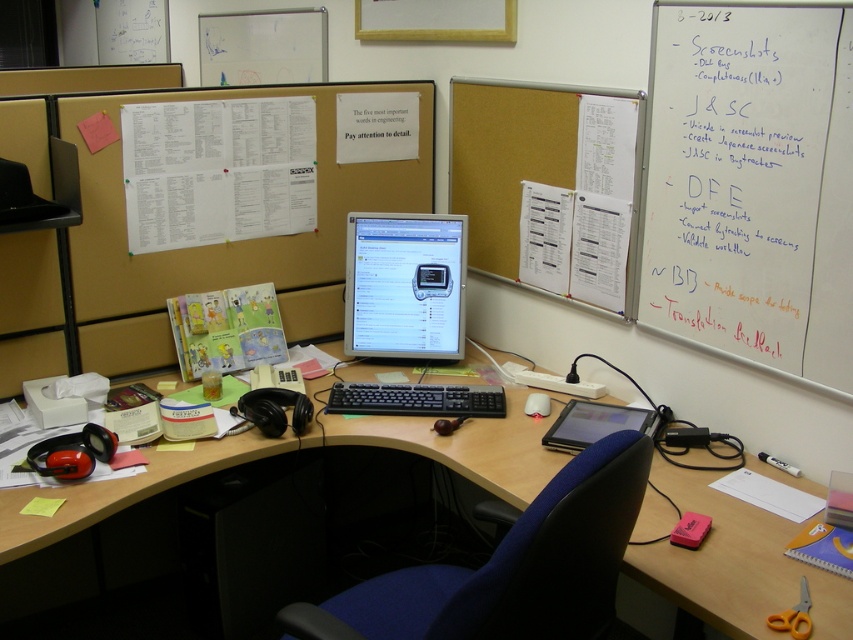
Looking at the desk in the scene, which monitor is positioned to the left between the matte black monitor at center and the matte plastic monitor at center?

The matte black monitor at center is positioned to the left of the matte plastic monitor at center.

You are a person who needs to sit down at the desk. The blue fabric swivel chair at center and the black plastic keyboard at center are in your way. Which one should you move to make space for your legs?

The blue fabric swivel chair at center is wider than the black plastic keyboard at center, so you should move the blue fabric swivel chair at center to create more space for your legs.